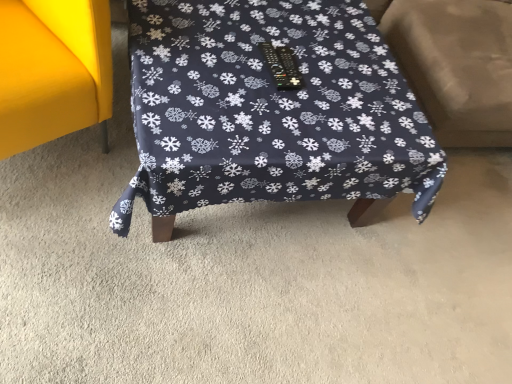
Question: Should I look upward or downward to see dark blue fabric table at center, the 1th furniture from the right?

Choices:
 (A) up
 (B) down

Answer: (A)

Question: From a real-world perspective, is beige fabric swivel chair at right located higher than dark blue fabric table at center, which is the second furniture from left to right?

Choices:
 (A) no
 (B) yes

Answer: (B)

Question: Does beige fabric swivel chair at right touch dark blue fabric table at center, the 1th furniture from the right?

Choices:
 (A) no
 (B) yes

Answer: (A)

Question: Does beige fabric swivel chair at right have a larger size compared to dark blue fabric table at center, which is the second furniture from left to right?

Choices:
 (A) yes
 (B) no

Answer: (A)

Question: Does beige fabric swivel chair at right appear on the left side of dark blue fabric table at center, which is the second furniture from left to right?

Choices:
 (A) yes
 (B) no

Answer: (B)

Question: Is the position of beige fabric swivel chair at right more distant than that of dark blue fabric table at center, the 1th furniture from the right?

Choices:
 (A) yes
 (B) no

Answer: (A)

Question: Does beige fabric swivel chair at right have a greater height compared to dark blue fabric table at center, the 1th furniture from the right?

Choices:
 (A) yes
 (B) no

Answer: (A)

Question: Is beige fabric swivel chair at right surrounded by dark blue fabric table at center, which is the second furniture from left to right?

Choices:
 (A) no
 (B) yes

Answer: (A)

Question: Is dark blue fabric table at center, the 1th furniture from the right, in front of beige fabric swivel chair at right?

Choices:
 (A) yes
 (B) no

Answer: (A)

Question: From the image's perspective, is dark blue fabric table at center, which is the second furniture from left to right, on top of beige fabric swivel chair at right?

Choices:
 (A) yes
 (B) no

Answer: (B)

Question: Is dark blue fabric table at center, which is the second furniture from left to right, bigger than beige fabric swivel chair at right?

Choices:
 (A) yes
 (B) no

Answer: (B)

Question: Considering the relative sizes of dark blue fabric table at center, the 1th furniture from the right, and beige fabric swivel chair at right in the image provided, is dark blue fabric table at center, the 1th furniture from the right, taller than beige fabric swivel chair at right?

Choices:
 (A) yes
 (B) no

Answer: (B)

Question: Is dark blue fabric table at center, which is the second furniture from left to right, far away from beige fabric swivel chair at right?

Choices:
 (A) no
 (B) yes

Answer: (A)

Question: Does dark blue fabric table at center, the 1th furniture from the right, turn towards matte yellow sofa at left, acting as the 1th furniture starting from the left?

Choices:
 (A) no
 (B) yes

Answer: (A)